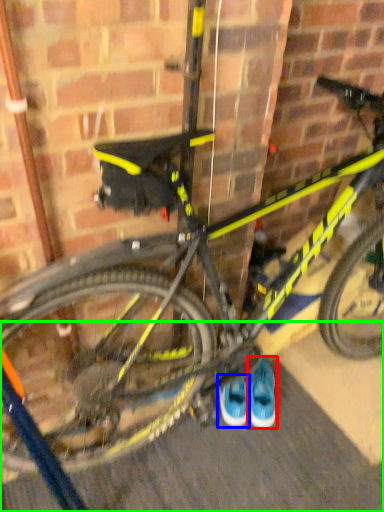
Question: Which object is the closest to the footwear (highlighted by a red box)? Choose among these: footwear (highlighted by a blue box) or pavement (highlighted by a green box).

Choices:
 (A) footwear
 (B) pavement

Answer: (A)